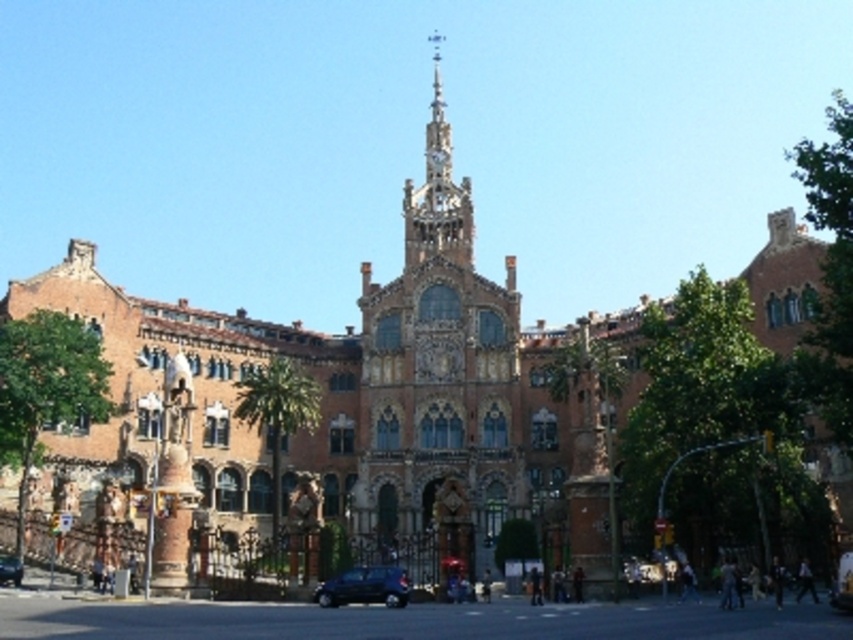
Does golden stone clock tower at center lie in front of shiny black car at lower center?

No, golden stone clock tower at center is behind shiny black car at lower center.

Is golden stone clock tower at center positioned at the back of shiny black car at lower center?

Yes, it is.

Which is in front, point (418, 234) or point (405, 577)?

Positioned in front is point (405, 577).

Where is `golden stone clock tower at center`? golden stone clock tower at center is located at coordinates (437, 193).

What do you see at coordinates (439, 374) in the screenshot?
I see `golden ornate tower at center` at bounding box center [439, 374].

How much distance is there between golden ornate tower at center and golden stone clock tower at center?

They are 24.32 feet apart.

Is point (425, 125) farther from viewer compared to point (424, 225)?

Yes, it is.

Identify the location of golden ornate tower at center. The height and width of the screenshot is (640, 853). (439, 374).

Who is shorter, shiny black car at lower center or metallic blue car at lower left?

metallic blue car at lower left

Does shiny black car at lower center appear on the left side of metallic blue car at lower left?

No, shiny black car at lower center is not to the left of metallic blue car at lower left.

Find the location of a particular element. shiny black car at lower center is located at coordinates (364, 586).

I want to click on shiny black car at lower center, so 364,586.